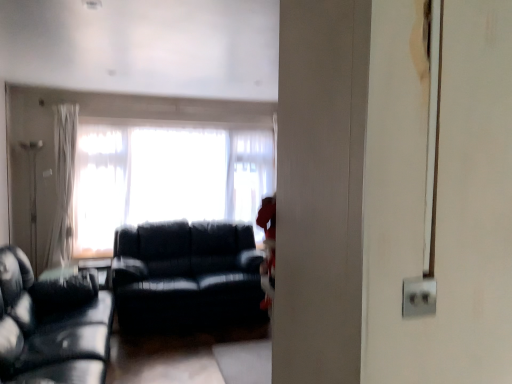
Question: Is translucent fabric window at center positioned with its back to matte black couch at center, the 2th studio couch when ordered from front to back?

Choices:
 (A) no
 (B) yes

Answer: (A)

Question: Can you confirm if translucent fabric window at center is shorter than matte black couch at center, the 1th studio couch when ordered from back to front?

Choices:
 (A) no
 (B) yes

Answer: (A)

Question: Can you confirm if translucent fabric window at center is positioned to the left of matte black couch at center, the 1th studio couch when ordered from back to front?

Choices:
 (A) yes
 (B) no

Answer: (A)

Question: Considering the relative positions of translucent fabric window at center and matte black couch at center, the 1th studio couch when ordered from back to front, in the image provided, is translucent fabric window at center to the right of matte black couch at center, the 1th studio couch when ordered from back to front, from the viewer's perspective?

Choices:
 (A) yes
 (B) no

Answer: (B)

Question: From the image's perspective, would you say translucent fabric window at center is positioned over matte black couch at center, the 2th studio couch when ordered from front to back?

Choices:
 (A) no
 (B) yes

Answer: (B)

Question: Is point (247, 319) closer or farther from the camera than point (25, 375)?

Choices:
 (A) farther
 (B) closer

Answer: (A)

Question: From their relative heights in the image, would you say matte black couch at center, the 1th studio couch when ordered from back to front, is taller or shorter than black leather couch at left, the 2th studio couch in the back-to-front sequence?

Choices:
 (A) short
 (B) tall

Answer: (B)

Question: Choose the correct answer: Is matte black couch at center, the 1th studio couch when ordered from back to front, inside black leather couch at left, which ranks as the first studio couch in front-to-back order, or outside it?

Choices:
 (A) inside
 (B) outside

Answer: (B)

Question: In the image, is matte black couch at center, the 1th studio couch when ordered from back to front, positioned in front of or behind black leather couch at left, which ranks as the first studio couch in front-to-back order?

Choices:
 (A) behind
 (B) front

Answer: (A)

Question: From a real-world perspective, is matte black couch at center, the 1th studio couch when ordered from back to front, physically located above or below translucent fabric window at center?

Choices:
 (A) above
 (B) below

Answer: (B)

Question: In terms of height, does matte black couch at center, the 2th studio couch when ordered from front to back, look taller or shorter compared to translucent fabric window at center?

Choices:
 (A) short
 (B) tall

Answer: (A)

Question: Considering the positions of point (237, 269) and point (91, 140), is point (237, 269) closer or farther from the camera than point (91, 140)?

Choices:
 (A) farther
 (B) closer

Answer: (B)

Question: Is matte black couch at center, the 1th studio couch when ordered from back to front, wider or thinner than translucent fabric window at center?

Choices:
 (A) thin
 (B) wide

Answer: (B)

Question: Is point coord(64,175) positioned closer to the camera than point coord(40,329)?

Choices:
 (A) farther
 (B) closer

Answer: (A)

Question: Looking at their shapes, would you say white sheer curtain at left is wider or thinner than black leather couch at left, the 2th studio couch in the back-to-front sequence?

Choices:
 (A) wide
 (B) thin

Answer: (B)